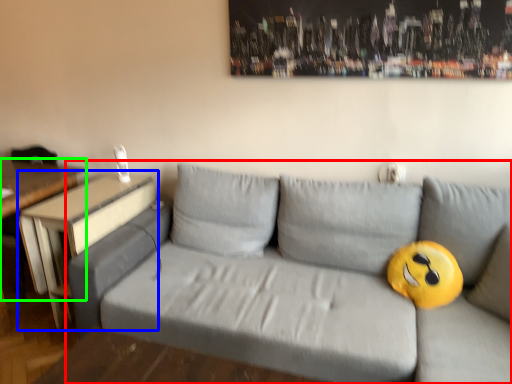
Question: Based on their relative distances, which object is farther from studio couch (highlighted by a red box)? Choose from table (highlighted by a blue box) and table (highlighted by a green box).

Choices:
 (A) table
 (B) table

Answer: (B)